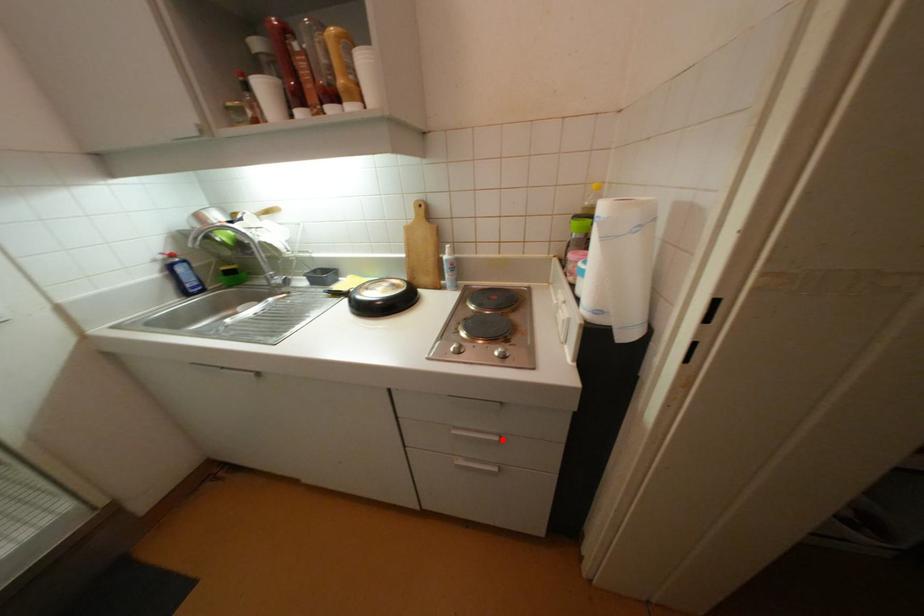
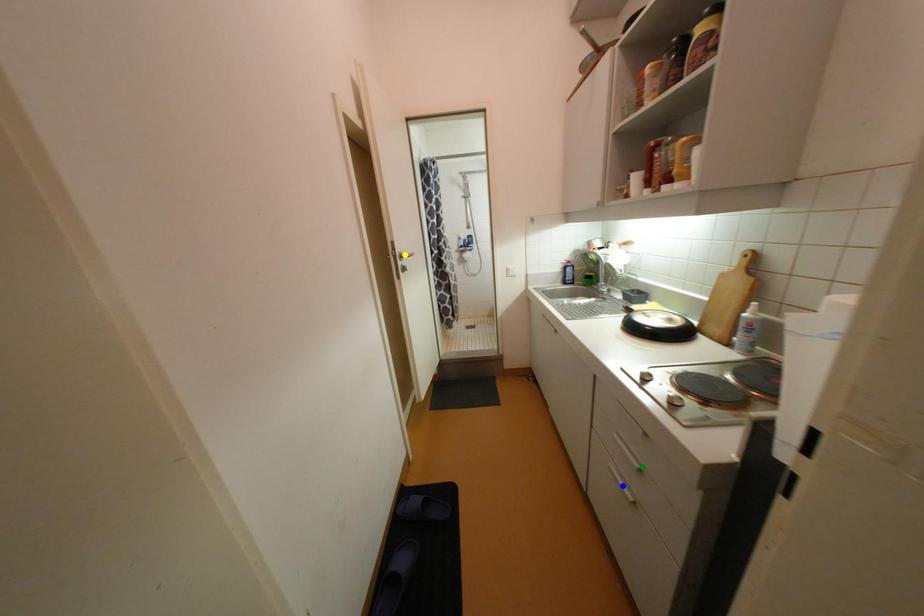
Question: I am providing you with two images of the same scene from different viewpoints. A red point is marked on the first image. You are given multiple points on the second image. In image 2, which mark is for the same physical point as the one in image 1?

Choices:
 (A) blue point
 (B) green point
 (C) yellow point

Answer: (B)